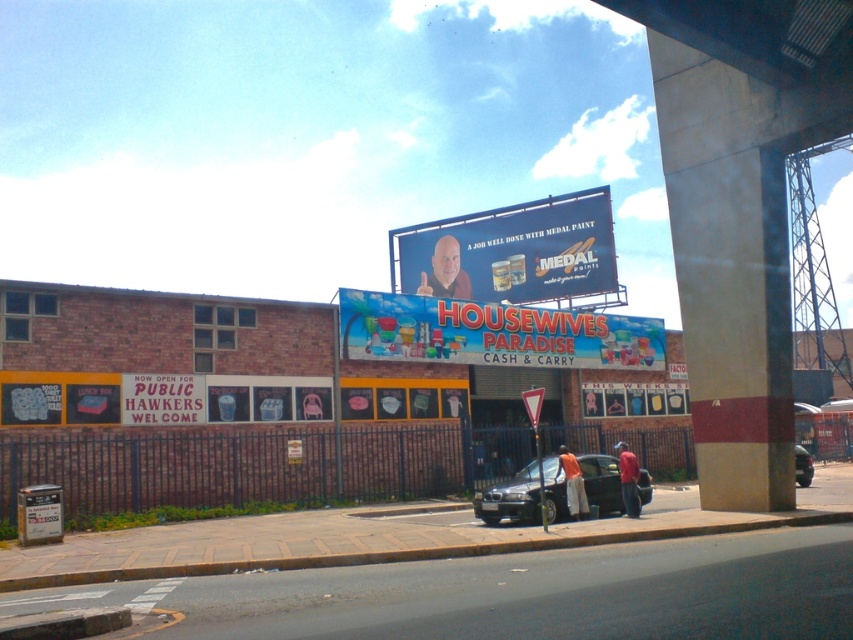
Does matte plastic billboard at center have a lesser width compared to metallic gray sedan at lower right?

In fact, matte plastic billboard at center might be wider than metallic gray sedan at lower right.

Is point (509, 225) behind point (795, 445)?

Yes.

Which is behind, point (434, 248) or point (804, 477)?

The point (434, 248) is behind.

The width and height of the screenshot is (853, 640). Find the location of `matte plastic billboard at center`. matte plastic billboard at center is located at coordinates (511, 252).

Can you confirm if shiny black car at center is shorter than metallic silver sign at lower center?

Answer: Yes, shiny black car at center is shorter than metallic silver sign at lower center.

Consider the image. Is shiny black car at center to the left of metallic silver sign at lower center from the viewer's perspective?

Correct, you'll find shiny black car at center to the left of metallic silver sign at lower center.

Describe the element at coordinates (509, 499) in the screenshot. This screenshot has height=640, width=853. I see `shiny black car at center` at that location.

This screenshot has width=853, height=640. I want to click on shiny black car at center, so click(509, 499).

Between matte plastic billboard at center and white plastic sign at lower left, which one appears on the right side from the viewer's perspective?

From the viewer's perspective, matte plastic billboard at center appears more on the right side.

Does matte plastic billboard at center appear on the left side of white plastic sign at lower left?

In fact, matte plastic billboard at center is to the right of white plastic sign at lower left.

Describe the element at coordinates (511, 252) in the screenshot. I see `matte plastic billboard at center` at that location.

Image resolution: width=853 pixels, height=640 pixels. Identify the location of matte plastic billboard at center. (511, 252).